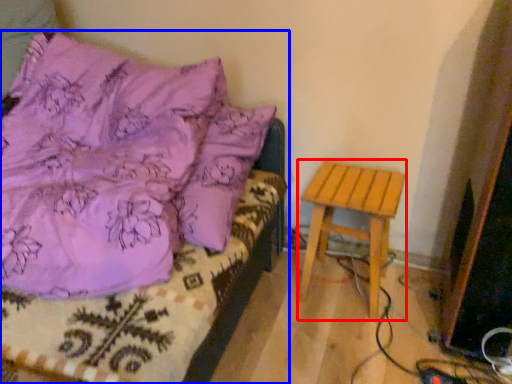
Question: Which object appears farthest to the camera in this image, stool (highlighted by a red box) or furniture (highlighted by a blue box)?

Choices:
 (A) stool
 (B) furniture

Answer: (A)